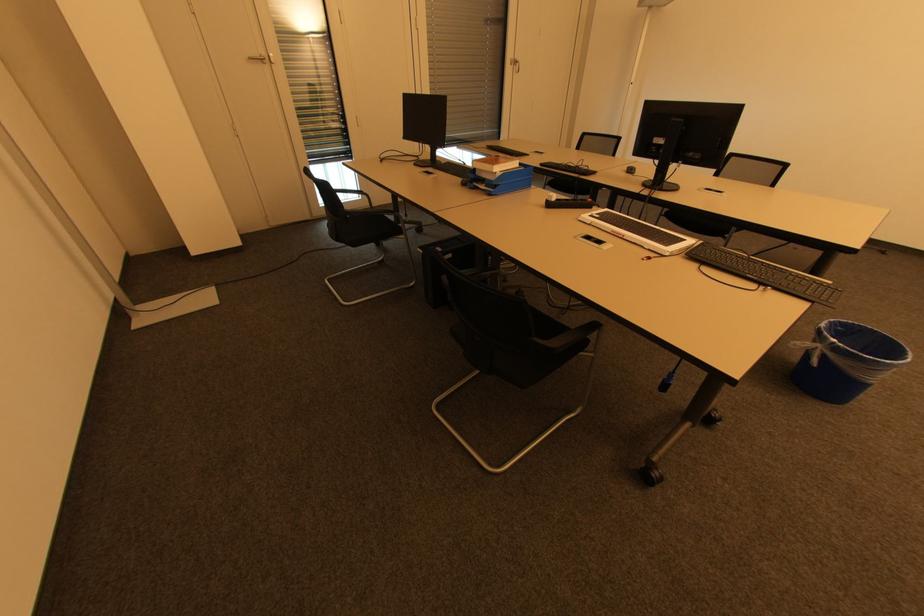
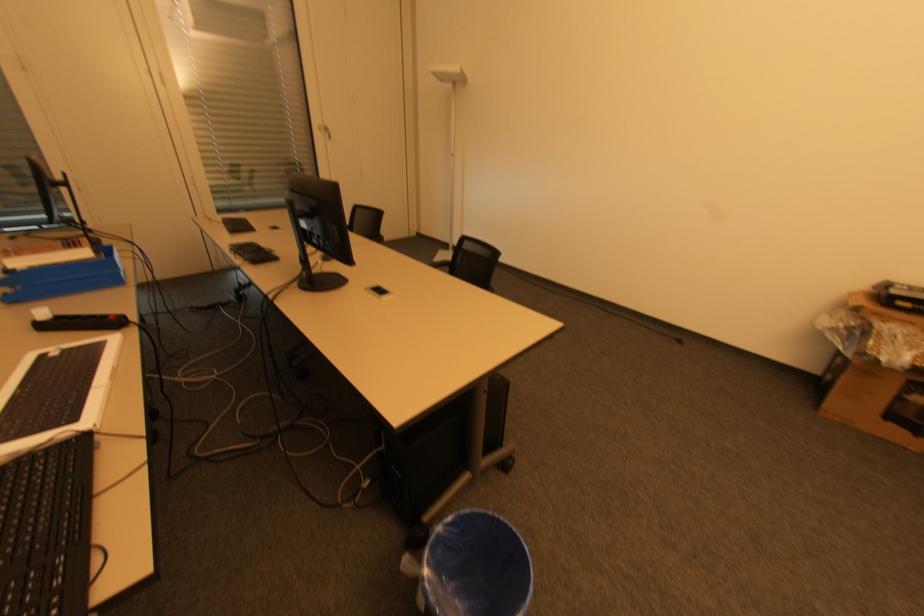
Question: Which direction would the cameraman need to move to produce the second image? Reply with the corresponding letter.

Choices:
 (A) Left
 (B) Right
 (C) Forward
 (D) Backward

Answer: (B)